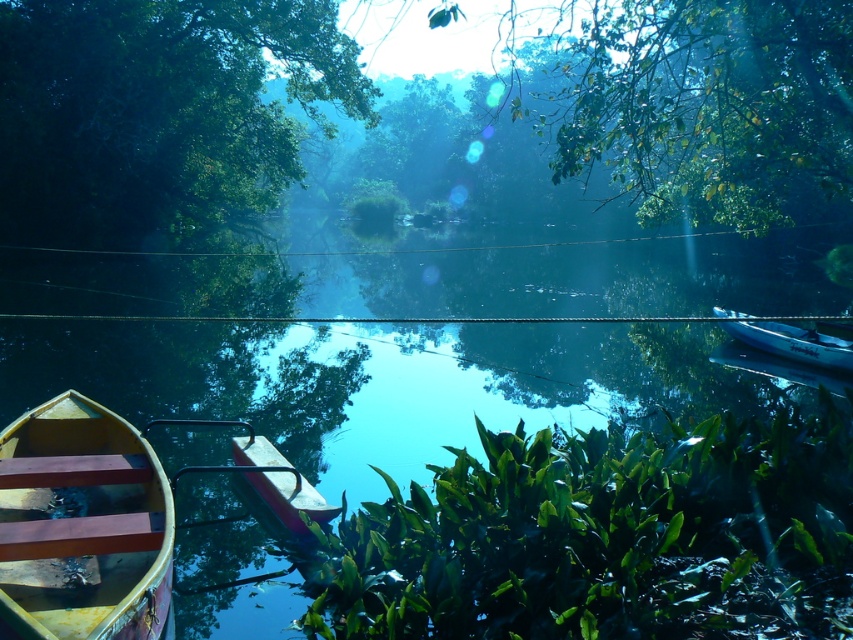
Question: Which object appears closest to the camera in this image?

Choices:
 (A) white plastic boat at right
 (B) wooden canoe at center
 (C) green leafy tree at upper center

Answer: (B)

Question: Is transparent glass river at center to the left of wooden canoe at center from the viewer's perspective?

Choices:
 (A) no
 (B) yes

Answer: (A)

Question: From the image, what is the correct spatial relationship of wooden canoe at center in relation to white plastic boat at right?

Choices:
 (A) below
 (B) above

Answer: (A)

Question: Based on their relative distances, which object is nearer to the green leafy tree at upper left?

Choices:
 (A) transparent glass river at center
 (B) green leafy plant at center
 (C) green leafy tree at upper center
 (D) wooden canoe at center

Answer: (A)

Question: Is transparent glass river at center bigger than wooden canoe at center?

Choices:
 (A) yes
 (B) no

Answer: (A)

Question: Which object is closer to the camera taking this photo?

Choices:
 (A) green leafy tree at upper left
 (B) wooden boat at lower left

Answer: (B)